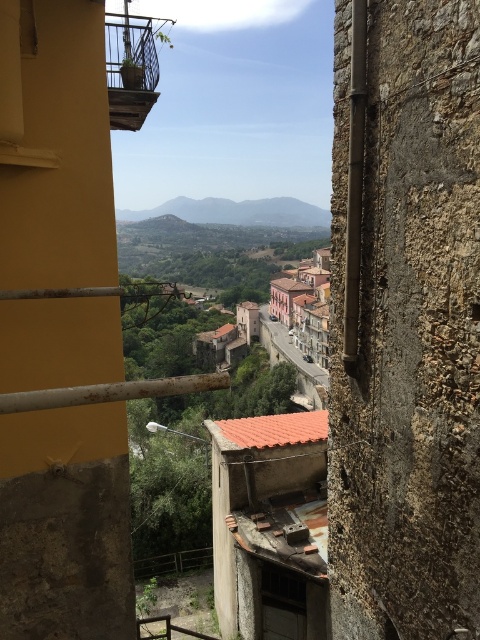
You are standing on the balcony of the building with yellow walls and want to look at the view. Which object, the green grassy hillside at center or the smooth stone alley at center, is closer to you?

The green grassy hillside at center is closer to you because the smooth stone alley at center is behind it.

You are standing on the balcony of the building with yellow walls and stone accents. You see a point marked at coordinates (304,305). What is the object located at this point?

The point at coordinates (304,305) marks a terracotta tiled building at center.